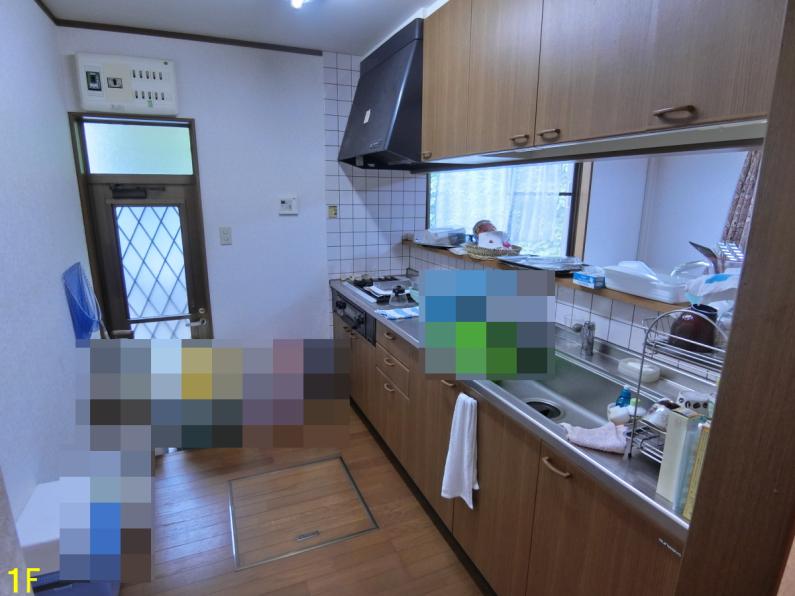
You are a GUI agent. You are given a task and a screenshot of the screen. Output one action in this format:
    pyautogui.click(x=<x>, y=<y>)
    Task: Click on the kitchen door
    Image resolution: width=795 pixels, height=596 pixels.
    Given the screenshot: What is the action you would take?
    coord(169,280)